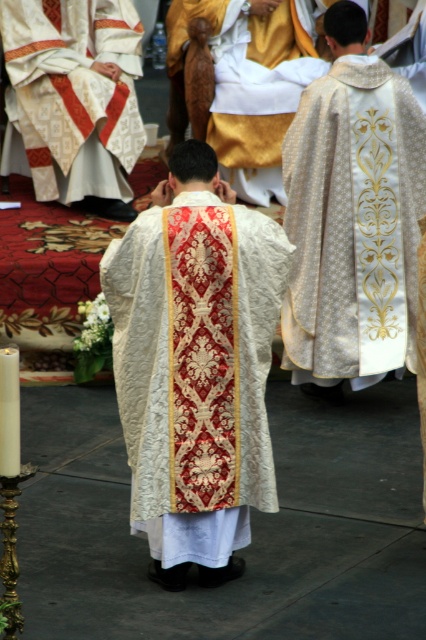
From the picture: Is silver metallic vestment at center positioned before white embroidered vestment at center?

Yes, silver metallic vestment at center is in front of white embroidered vestment at center.

Who is lower down, silver metallic vestment at center or white embroidered vestment at center?

silver metallic vestment at center is below.

Between point (336, 188) and point (31, 148), which one is positioned behind?

Point (31, 148)

Identify the location of silver metallic vestment at center. This screenshot has height=640, width=426. (353, 225).

Looking at this image, can you confirm if embroidered silk vestment at center is thinner than silver metallic vestment at center?

Yes.

Between point (176, 387) and point (388, 276), which one is positioned behind?

Positioned behind is point (388, 276).

Does point (233, 349) lie in front of point (411, 256)?

Yes, point (233, 349) is closer to viewer.

Locate an element on the screen. The image size is (426, 640). embroidered silk vestment at center is located at coordinates click(195, 371).

Measure the distance from embroidered silk vestment at center to white embroidered vestment at center.

embroidered silk vestment at center and white embroidered vestment at center are 16.60 feet apart.

Does embroidered silk vestment at center have a greater height compared to white embroidered vestment at center?

No, embroidered silk vestment at center is not taller than white embroidered vestment at center.

Describe the element at coordinates (195, 371) in the screenshot. The width and height of the screenshot is (426, 640). I see `embroidered silk vestment at center` at that location.

Image resolution: width=426 pixels, height=640 pixels. Identify the location of embroidered silk vestment at center. (195, 371).